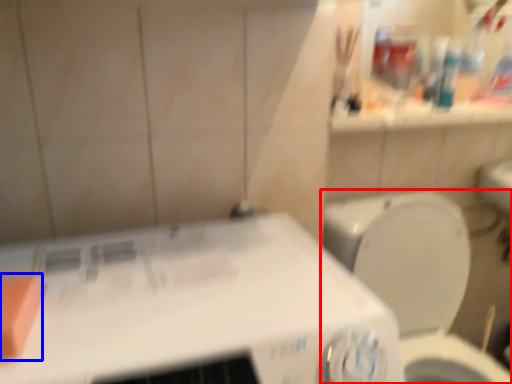
Question: Which object is further to the camera taking this photo, toilet (highlighted by a red box) or soap (highlighted by a blue box)?

Choices:
 (A) toilet
 (B) soap

Answer: (A)